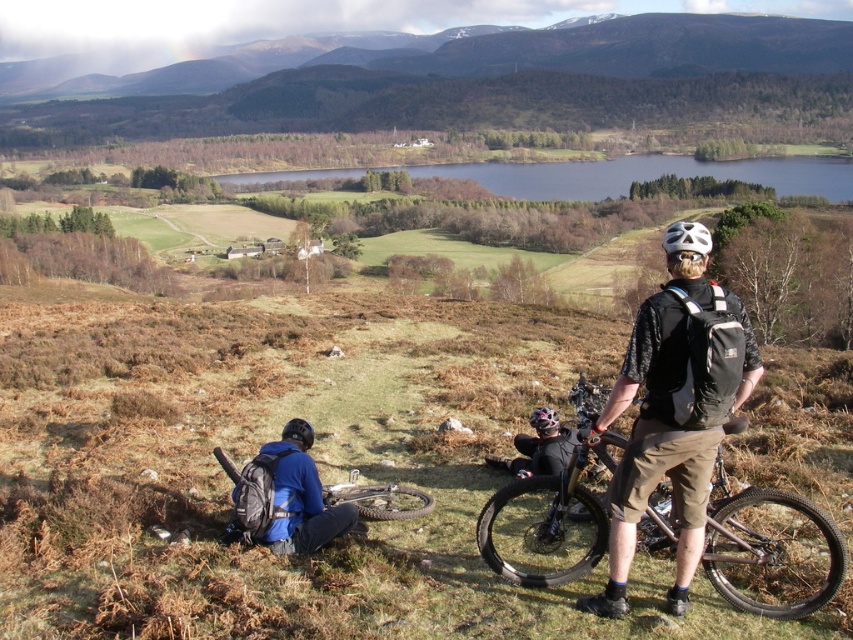
Consider the image. You are standing at the point labeled point (x=286, y=435) and want to move towards the point labeled point (x=543, y=422). Which direction should you head?

Since point (x=286, y=435) is closer to you than point (x=543, y=422), you should move away from your current position towards the point labeled point (x=543, y=422).

You are a mountain biker planning to ride through this trail. You see the matte black mountain bike at lower left and the matte black helmet at center. Which object is positioned further to the left?

The matte black mountain bike at lower left is positioned further to the left than the matte black helmet at center.